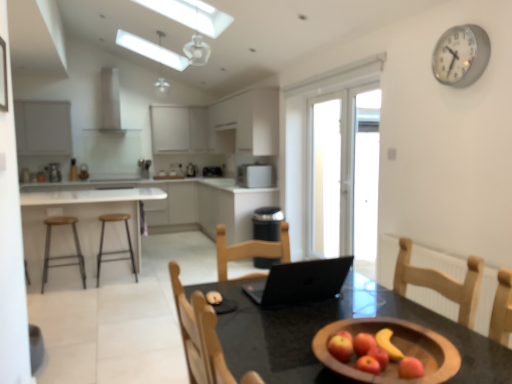
Question: Is white matte cabinetry at left, the 2th cabinetry from the left, located outside satin silver toaster at center, the second appliance from the left?

Choices:
 (A) yes
 (B) no

Answer: (A)

Question: From a real-world perspective, is white matte cabinetry at left, the 2th cabinetry from the left, on top of satin silver toaster at center, which is counted as the 1th appliance, starting from the back?

Choices:
 (A) no
 (B) yes

Answer: (A)

Question: From the image's perspective, is white matte cabinetry at left, which is the 4th cabinetry from right to left, located beneath satin silver toaster at center, the second appliance from the left?

Choices:
 (A) no
 (B) yes

Answer: (B)

Question: Is satin silver toaster at center, placed as the 3th appliance when sorted from front to back, located within white matte cabinetry at left, which is the 4th cabinetry from right to left?

Choices:
 (A) no
 (B) yes

Answer: (A)

Question: Is white matte cabinetry at left, which is the 4th cabinetry from right to left, aimed at satin silver toaster at center, which appears as the second appliance when viewed from the right?

Choices:
 (A) no
 (B) yes

Answer: (A)

Question: Is white matte cabinetry at left, which is the 4th cabinetry from right to left, touching satin silver toaster at center, which is counted as the 1th appliance, starting from the back?

Choices:
 (A) no
 (B) yes

Answer: (A)

Question: Is white matte cabinet at upper center, which appears as the third cabinetry when viewed from the left, next to red matte apple at lower center?

Choices:
 (A) no
 (B) yes

Answer: (A)

Question: Is white matte cabinet at upper center, the 3th cabinetry viewed from the right, not close to red matte apple at lower center?

Choices:
 (A) yes
 (B) no

Answer: (A)

Question: Does white matte cabinet at upper center, the 3th cabinetry viewed from the right, have a greater height compared to red matte apple at lower center?

Choices:
 (A) no
 (B) yes

Answer: (B)

Question: Considering the relative positions of white matte cabinet at upper center, the 3th cabinetry viewed from the right, and red matte apple at lower center in the image provided, is white matte cabinet at upper center, the 3th cabinetry viewed from the right, behind red matte apple at lower center?

Choices:
 (A) no
 (B) yes

Answer: (B)

Question: Is white matte cabinet at upper center, which appears as the third cabinetry when viewed from the left, positioned before red matte apple at lower center?

Choices:
 (A) no
 (B) yes

Answer: (A)

Question: Is white matte cabinet at upper center, the 3th cabinetry viewed from the right, oriented towards red matte apple at lower center?

Choices:
 (A) yes
 (B) no

Answer: (A)

Question: Is white matte exhaust hood at upper center facing towards white matte cabinet at upper center, the 4th cabinetry in the left-to-right sequence?

Choices:
 (A) no
 (B) yes

Answer: (A)